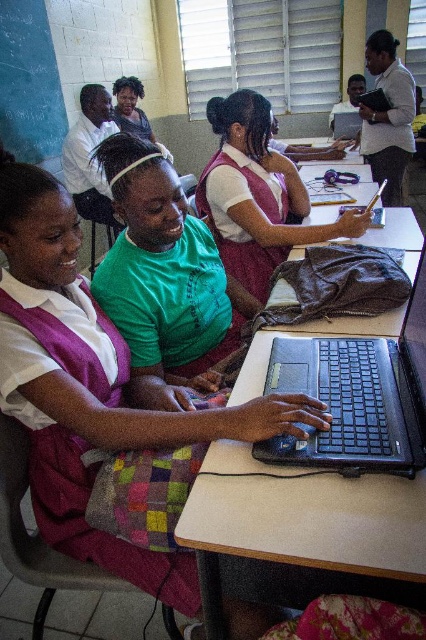
Does matte purple vest at center have a greater height compared to green fabric shirt at center?

Correct, matte purple vest at center is much taller as green fabric shirt at center.

The image size is (426, 640). Describe the element at coordinates (94, 387) in the screenshot. I see `matte purple vest at center` at that location.

Identify the location of matte purple vest at center. (94, 387).

Find the location of a particular element. The image size is (426, 640). matte purple vest at center is located at coordinates (94, 387).

From the picture: Who is positioned more to the right, green fabric shirt at center or black matte laptop at center?

From the viewer's perspective, black matte laptop at center appears more on the right side.

Does point (132, 385) come behind point (403, 429)?

Yes, it is behind point (403, 429).

Who is more forward, [169,266] or [328,348]?

Positioned in front is point [328,348].

This screenshot has height=640, width=426. Identify the location of green fabric shirt at center. (158, 269).

Is black matte laptop at center positioned at the back of matte pink uniform at center?

No, black matte laptop at center is in front of matte pink uniform at center.

Between black matte laptop at center and matte pink uniform at center, which one appears on the left side from the viewer's perspective?

matte pink uniform at center is more to the left.

Image resolution: width=426 pixels, height=640 pixels. I want to click on black matte laptop at center, so click(x=357, y=396).

This screenshot has width=426, height=640. Find the location of `black matte laptop at center`. black matte laptop at center is located at coordinates (357, 396).